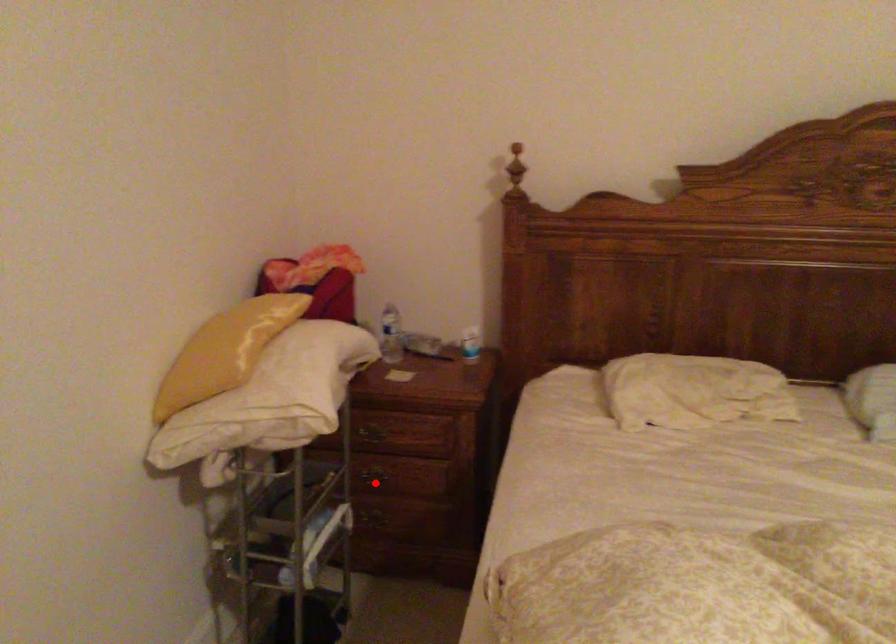
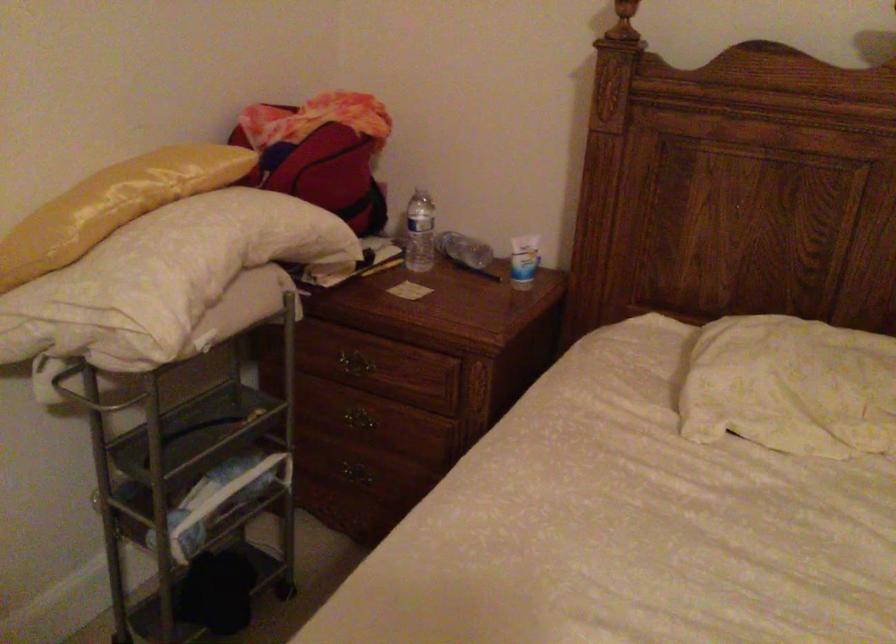
In the second image, find the point that corresponds to the highlighted location in the first image.

(357, 426)